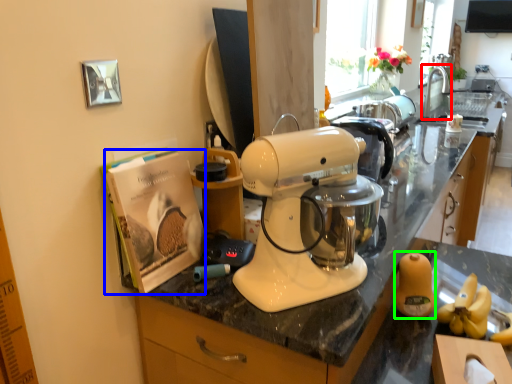
Question: Based on their relative distances, which object is farther from faucet (highlighted by a red box)? Choose from magazine (highlighted by a blue box) and food (highlighted by a green box).

Choices:
 (A) magazine
 (B) food

Answer: (A)